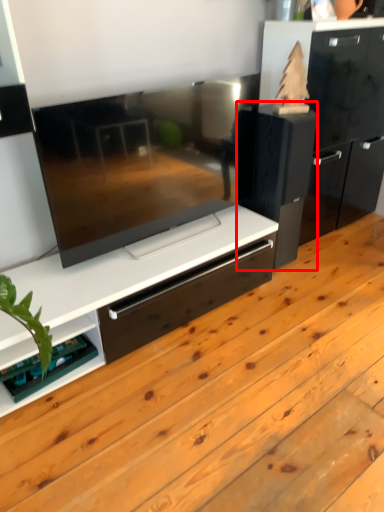
Question: From the image, what is the correct spatial relationship of appliance (annotated by the red box) in relation to shelf?

Choices:
 (A) left
 (B) right

Answer: (B)